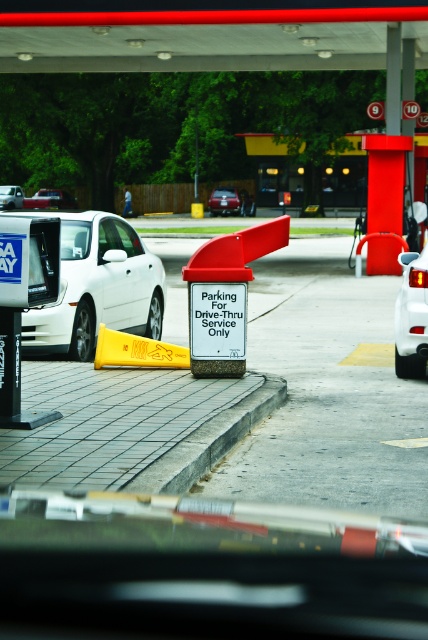
Is gray concrete curb at lower center below yellow plastic cone at center?

Yes.

Is gray concrete curb at lower center to the left of yellow plastic cone at center from the viewer's perspective?

Incorrect, gray concrete curb at lower center is not on the left side of yellow plastic cone at center.

This screenshot has width=428, height=640. Find the location of `gray concrete curb at lower center`. gray concrete curb at lower center is located at coordinates (208, 442).

Who is higher up, white matte car at right or matte white sedan at center?

Positioned higher is matte white sedan at center.

Measure the distance between point (x=419, y=253) and camera.

The distance of point (x=419, y=253) from camera is 11.06 meters.

Locate an element on the screen. white matte car at right is located at coordinates (412, 316).

Is point (407, 285) in front of point (14, 208)?

Yes.

Which is behind, point (413, 316) or point (5, 192)?

Positioned behind is point (5, 192).

Who is more distant from viewer, (x=422, y=376) or (x=14, y=188)?

Point (x=14, y=188)

Image resolution: width=428 pixels, height=640 pixels. In order to click on white matte car at right in this screenshot , I will do `click(412, 316)`.